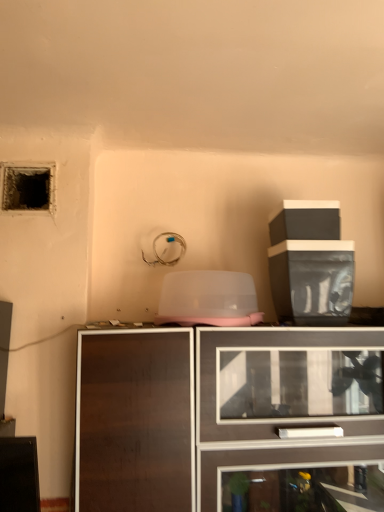
Question: Should I look upward or downward to see dark textured hole at upper left?

Choices:
 (A) down
 (B) up

Answer: (B)

Question: Considering the relative sizes of dark wood cabinet at center, the second cabinetry positioned from the top, and black plastic container at upper right, placed as the 1th cabinetry when sorted from top to bottom, in the image provided, is dark wood cabinet at center, the second cabinetry positioned from the top, taller than black plastic container at upper right, placed as the 1th cabinetry when sorted from top to bottom,?

Choices:
 (A) yes
 (B) no

Answer: (A)

Question: Does dark wood cabinet at center, the second cabinetry positioned from the top, turn towards black plastic container at upper right, placed as the 1th cabinetry when sorted from top to bottom?

Choices:
 (A) yes
 (B) no

Answer: (B)

Question: From the image's perspective, is dark wood cabinet at center, the second cabinetry positioned from the top, under black plastic container at upper right, acting as the 2th cabinetry starting from the bottom?

Choices:
 (A) no
 (B) yes

Answer: (B)

Question: Is dark wood cabinet at center, the second cabinetry positioned from the top, bigger than black plastic container at upper right, placed as the 1th cabinetry when sorted from top to bottom?

Choices:
 (A) yes
 (B) no

Answer: (A)

Question: Does dark wood cabinet at center, the second cabinetry positioned from the top, appear on the left side of black plastic container at upper right, acting as the 2th cabinetry starting from the bottom?

Choices:
 (A) yes
 (B) no

Answer: (A)

Question: Is dark wood cabinet at center, the 1th cabinetry when ordered from bottom to top, next to black plastic container at upper right, acting as the 2th cabinetry starting from the bottom?

Choices:
 (A) yes
 (B) no

Answer: (B)

Question: Is black plastic container at upper right, placed as the 1th cabinetry when sorted from top to bottom, to the right of dark wood cabinet at center, the second cabinetry positioned from the top, from the viewer's perspective?

Choices:
 (A) no
 (B) yes

Answer: (B)

Question: From a real-world perspective, is black plastic container at upper right, placed as the 1th cabinetry when sorted from top to bottom, under dark wood cabinet at center, the second cabinetry positioned from the top?

Choices:
 (A) no
 (B) yes

Answer: (A)

Question: Is black plastic container at upper right, acting as the 2th cabinetry starting from the bottom, aimed at dark wood cabinet at center, the second cabinetry positioned from the top?

Choices:
 (A) yes
 (B) no

Answer: (B)

Question: Is black plastic container at upper right, placed as the 1th cabinetry when sorted from top to bottom, facing away from dark wood cabinet at center, the second cabinetry positioned from the top?

Choices:
 (A) no
 (B) yes

Answer: (A)

Question: Does black plastic container at upper right, acting as the 2th cabinetry starting from the bottom, contain dark wood cabinet at center, the second cabinetry positioned from the top?

Choices:
 (A) yes
 (B) no

Answer: (B)

Question: Considering the relative sizes of black plastic container at upper right, placed as the 1th cabinetry when sorted from top to bottom, and dark wood cabinet at center, the second cabinetry positioned from the top, in the image provided, is black plastic container at upper right, placed as the 1th cabinetry when sorted from top to bottom, wider than dark wood cabinet at center, the second cabinetry positioned from the top,?

Choices:
 (A) no
 (B) yes

Answer: (A)

Question: Is black plastic container at upper right, placed as the 1th cabinetry when sorted from top to bottom, not inside dark textured hole at upper left?

Choices:
 (A) yes
 (B) no

Answer: (A)